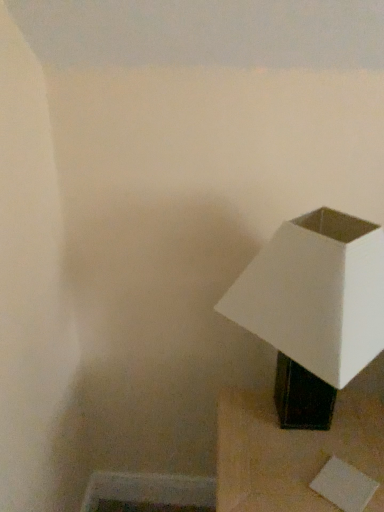
Image resolution: width=384 pixels, height=512 pixels. What do you see at coordinates (314, 309) in the screenshot?
I see `white matte lampshade at right` at bounding box center [314, 309].

You are a GUI agent. You are given a task and a screenshot of the screen. Output one action in this format:
    pyautogui.click(x=<x>, y=<y>)
    Task: Click on the white matte lampshade at right
    
    Given the screenshot: What is the action you would take?
    pyautogui.click(x=314, y=309)

This screenshot has width=384, height=512. What do you see at coordinates (292, 452) in the screenshot?
I see `black matte lamp at lower right` at bounding box center [292, 452].

Locate an element on the screen. black matte lamp at lower right is located at coordinates (292, 452).

You are a GUI agent. You are given a task and a screenshot of the screen. Output one action in this format:
    pyautogui.click(x=<x>, y=<y>)
    Task: Click on the white matte lampshade at right
    The height and width of the screenshot is (512, 384).
    Given the screenshot: What is the action you would take?
    pyautogui.click(x=314, y=309)

Which object is positioned more to the right, white matte lampshade at right or black matte lamp at lower right?

Positioned to the right is black matte lamp at lower right.

Is white matte lampshade at right behind black matte lamp at lower right?

No, it is not.

Which is closer, (354, 292) or (318, 452)?

Point (354, 292) appears to be closer to the viewer than point (318, 452).

From the image's perspective, who appears lower, white matte lampshade at right or black matte lamp at lower right?

black matte lamp at lower right is shown below in the image.

From a real-world perspective, between white matte lampshade at right and black matte lamp at lower right, who is vertically higher?

white matte lampshade at right is physically above.

Between white matte lampshade at right and black matte lamp at lower right, which one has larger width?

black matte lamp at lower right.

Who is shorter, white matte lampshade at right or black matte lamp at lower right?

black matte lamp at lower right.

From the picture: Is white matte lampshade at right smaller than black matte lamp at lower right?

Correct, white matte lampshade at right occupies less space than black matte lamp at lower right.

Is black matte lamp at lower right surrounded by white matte lampshade at right?

No.

From the picture: Is white matte lampshade at right not close to black matte lamp at lower right?

Actually, white matte lampshade at right and black matte lamp at lower right are a little close together.

Is white matte lampshade at right turned away from black matte lamp at lower right?

That's not correct — white matte lampshade at right is not looking away from black matte lamp at lower right.

What's the angular difference between white matte lampshade at right and black matte lamp at lower right's facing directions?

0.00126 degrees.

Where is `furniture that appears on the right of white matte lampshade at right`? furniture that appears on the right of white matte lampshade at right is located at coordinates pos(292,452).

Can you confirm if black matte lamp at lower right is positioned to the left of white matte lampshade at right?

No, black matte lamp at lower right is not to the left of white matte lampshade at right.

Considering the positions of objects black matte lamp at lower right and white matte lampshade at right in the image provided, who is behind, black matte lamp at lower right or white matte lampshade at right?

black matte lamp at lower right.

Is point (309, 482) closer or farther from the camera than point (268, 292)?

Point (309, 482).

From the image's perspective, between black matte lamp at lower right and white matte lampshade at right, who is located below?

black matte lamp at lower right is shown below in the image.

From a real-world perspective, relative to white matte lampshade at right, is black matte lamp at lower right vertically above or below?

In terms of real-world spatial position, black matte lamp at lower right is below white matte lampshade at right.

Does black matte lamp at lower right have a lesser width compared to white matte lampshade at right?

No, black matte lamp at lower right is not thinner than white matte lampshade at right.

Considering the sizes of black matte lamp at lower right and white matte lampshade at right in the image, is black matte lamp at lower right taller or shorter than white matte lampshade at right?

In the image, black matte lamp at lower right appears to be shorter than white matte lampshade at right.

Who is smaller, black matte lamp at lower right or white matte lampshade at right?

With smaller size is white matte lampshade at right.

Is white matte lampshade at right a part of black matte lamp at lower right?

No, white matte lampshade at right is not a part of black matte lamp at lower right.

Is black matte lamp at lower right far from white matte lampshade at right?

They are positioned close to each other.

Is black matte lamp at lower right positioned with its back to white matte lampshade at right?

No.

How different are the orientations of black matte lamp at lower right and white matte lampshade at right in degrees?

0.00126 degrees.

Locate an element on the screen. This screenshot has height=512, width=384. furniture behind the white matte lampshade at right is located at coordinates [292, 452].

This screenshot has height=512, width=384. Find the location of `lamp above the black matte lamp at lower right (from a real-world perspective)`. lamp above the black matte lamp at lower right (from a real-world perspective) is located at coordinates (314, 309).

Where is `furniture directly beneath the white matte lampshade at right (from a real-world perspective)`? The width and height of the screenshot is (384, 512). furniture directly beneath the white matte lampshade at right (from a real-world perspective) is located at coordinates (292, 452).